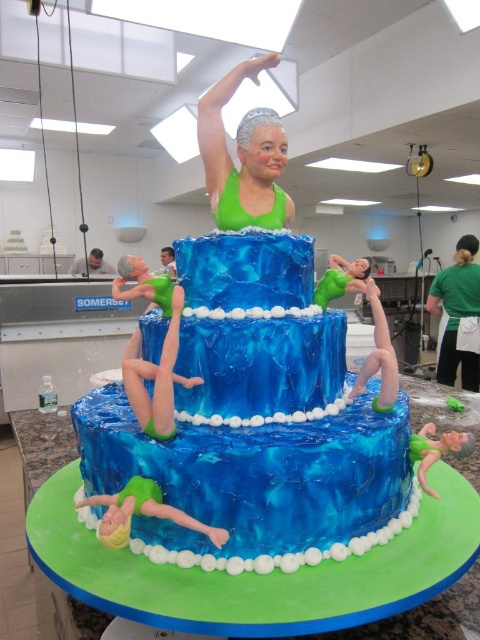
What are the coordinates of the blue marbled cake at center?

The coordinates of the blue marbled cake at center are at point (256, 420).

You are a guest at a birthday party where the cake is placed on a table. You want to take a photo of the blue marbled cake at center without any obstructions. Is the green fabric apron at lower right blocking your view of the cake?

The blue marbled cake at center is shorter than the green fabric apron at lower right, so the apron might block the view of the cake depending on the angle and distance. To ensure an unobstructed photo, move closer or adjust your position so the apron doesn not come between you and the cake.